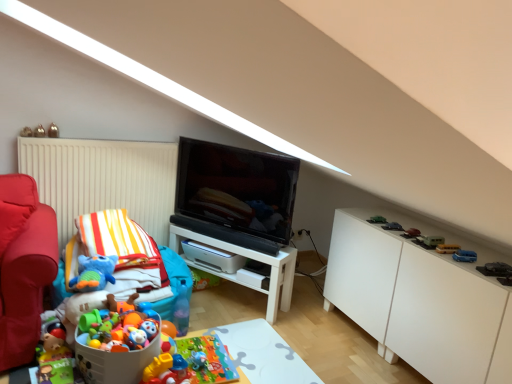
Where is `unoccupied area in front of green matte toy car at right, which ranks as the third toy in top-to-bottom order`? This screenshot has height=384, width=512. unoccupied area in front of green matte toy car at right, which ranks as the third toy in top-to-bottom order is located at coordinates (388, 225).